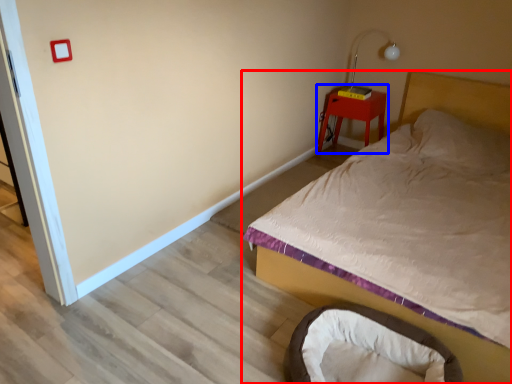
Question: Which object appears closest to the camera in this image, bed (highlighted by a red box) or nightstand (highlighted by a blue box)?

Choices:
 (A) bed
 (B) nightstand

Answer: (A)